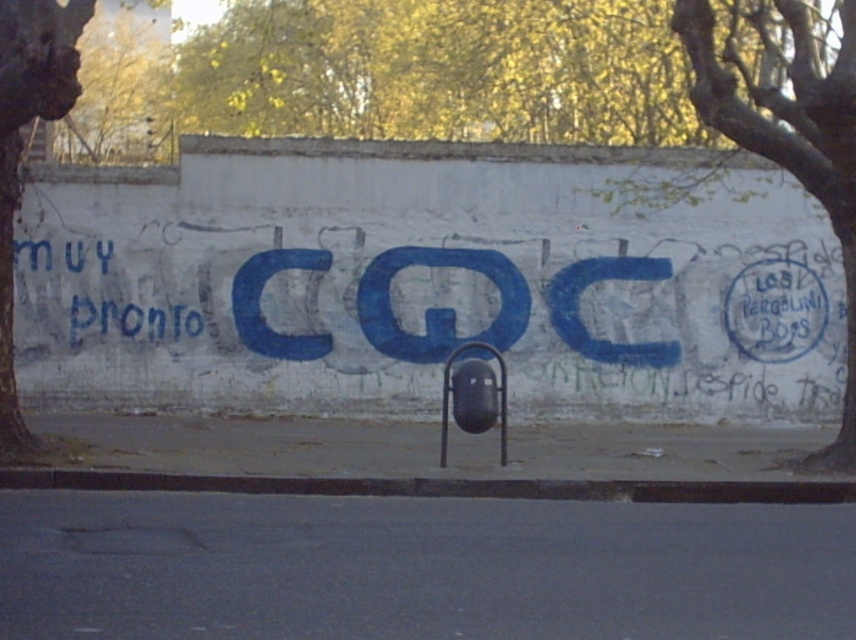
Does point (836, 308) come closer to viewer compared to point (141, 36)?

Yes, it is.

Who is more forward, [718,291] or [123,148]?

Point [718,291] is in front.

Locate an element on the screen. This screenshot has width=856, height=640. blue paint at center is located at coordinates (421, 323).

Can you confirm if yellow leafy tree at upper center is positioned to the right of green leafy tree at upper right?

No, yellow leafy tree at upper center is not to the right of green leafy tree at upper right.

The width and height of the screenshot is (856, 640). What do you see at coordinates (441, 70) in the screenshot?
I see `yellow leafy tree at upper center` at bounding box center [441, 70].

What do you see at coordinates (441, 70) in the screenshot? This screenshot has width=856, height=640. I see `yellow leafy tree at upper center` at bounding box center [441, 70].

I want to click on yellow leafy tree at upper center, so 441,70.

Is blue paint at center above green rough bark tree at left?

No.

Between point (90, 356) and point (63, 64), which one is positioned behind?

Positioned behind is point (90, 356).

Between point (524, 394) and point (15, 134), which one is positioned in front?

Point (15, 134) is in front.

I want to click on blue paint at center, so click(421, 323).